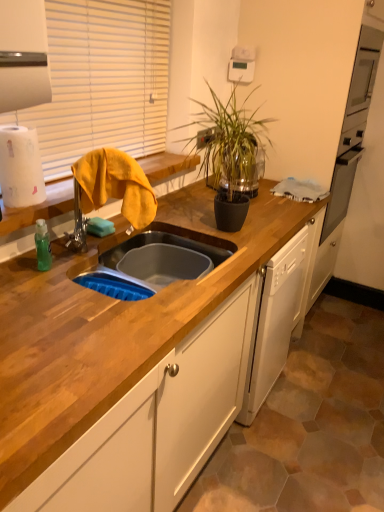
The height and width of the screenshot is (512, 384). I want to click on free spot to the right of green glossy plant at center, so click(278, 217).